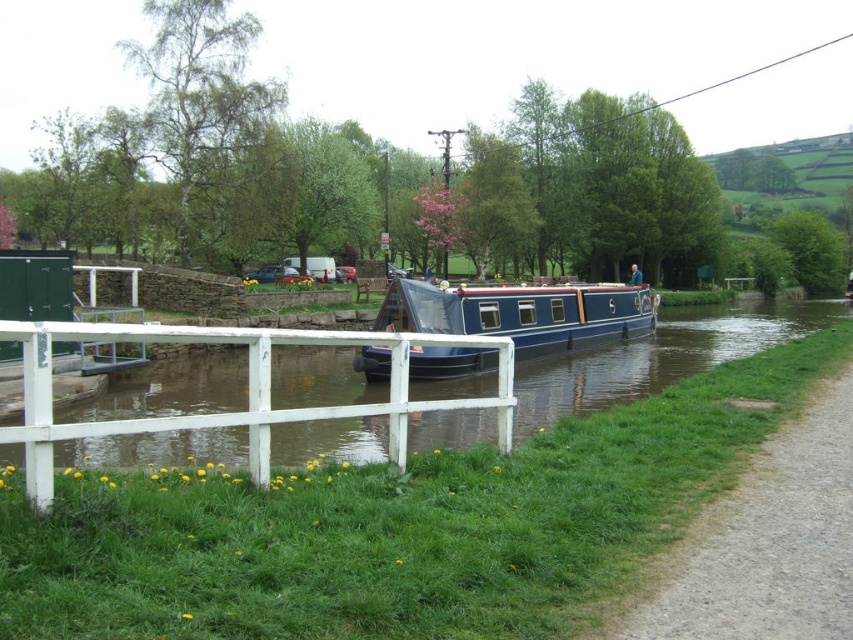
Which is more to the left, gravel path at lower right or blue polished wood barge at center?

gravel path at lower right is more to the left.

Can you confirm if gravel path at lower right is positioned below blue polished wood barge at center?

Indeed, gravel path at lower right is positioned under blue polished wood barge at center.

Which is in front, point (665, 573) or point (654, 301)?

Point (665, 573) is in front.

Find the location of `gravel path at lower right`. gravel path at lower right is located at coordinates (767, 541).

Is point (363, 440) more distant than point (572, 321)?

No, (363, 440) is closer to viewer.

Who is more forward, (711, 349) or (547, 326)?

Positioned in front is point (547, 326).

Where is `white wooden fence at lower left`? The image size is (853, 640). white wooden fence at lower left is located at coordinates click(x=660, y=356).

Is white wooden fence at lower left above gravel path at lower right?

Yes, white wooden fence at lower left is above gravel path at lower right.

Between point (703, 330) and point (804, 506), which one is positioned behind?

The point (703, 330) is behind.

Which is in front, point (637, 380) or point (730, 616)?

Point (730, 616) is in front.

Where is `white wooden fence at lower left`? This screenshot has height=640, width=853. white wooden fence at lower left is located at coordinates (660, 356).